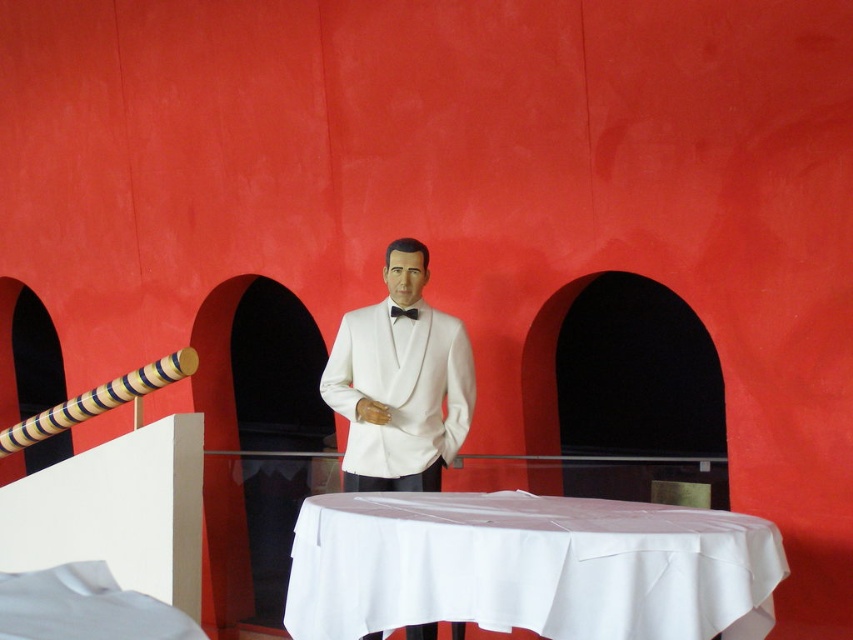
Question: Among these points, which one is farthest from the camera?

Choices:
 (A) (344, 579)
 (B) (428, 307)
 (C) (397, 310)

Answer: (B)

Question: In this image, where is white glossy tuxedo at center located relative to black satin bow tie at center?

Choices:
 (A) below
 (B) above

Answer: (A)

Question: Observing the image, what is the correct spatial positioning of white cloth-covered table at center in reference to white glossy tuxedo at center?

Choices:
 (A) below
 (B) above

Answer: (A)

Question: Which of the following is the farthest from the observer?

Choices:
 (A) white cloth-covered table at center
 (B) black satin bow tie at center
 (C) white glossy tuxedo at center

Answer: (B)

Question: Among these points, which one is nearest to the camera?

Choices:
 (A) (451, 372)
 (B) (396, 314)
 (C) (653, 570)

Answer: (C)

Question: Is white cloth-covered table at center bigger than black satin bow tie at center?

Choices:
 (A) yes
 (B) no

Answer: (A)